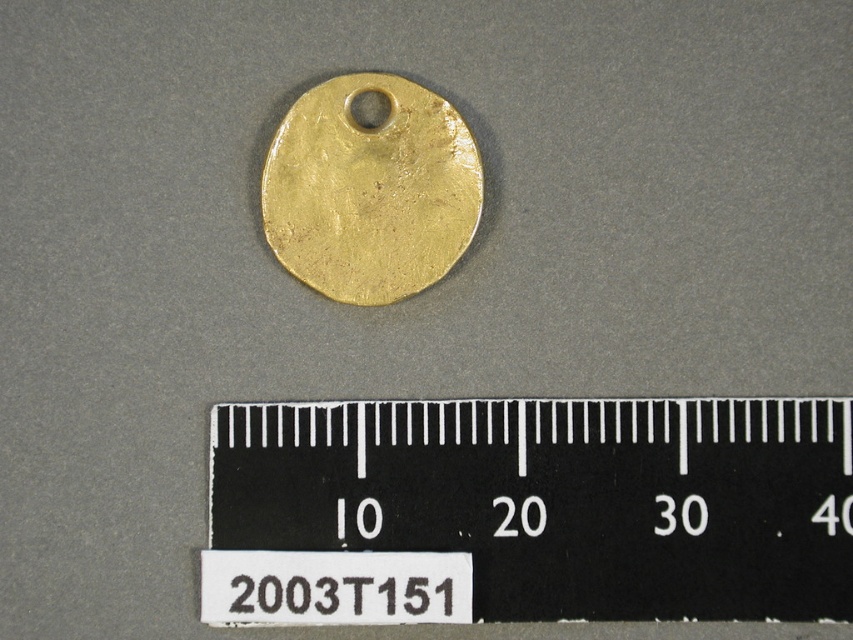
You are an appraiser examining an antique pendant. You see the gold matte disc at center and the black plastic ruler at center. Which object is located to the right of the other?

The black plastic ruler at center is positioned on the right side of gold matte disc at center.

You are an interior designer who needs to measure the diameter of the small circular gold pendant displayed on the gray background. You have a black plastic ruler at center. Where exactly should you place the ruler to measure the pendant?

You should place the black plastic ruler at center at point (529, 509) to measure the diameter of the small circular gold pendant.